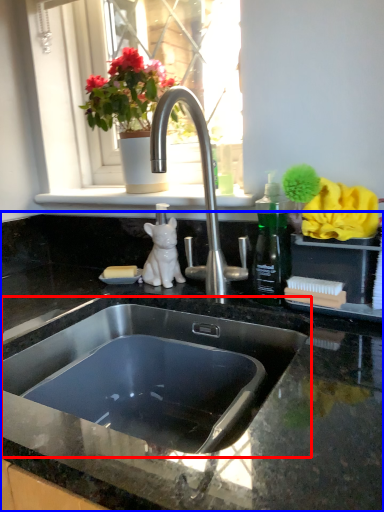
Question: Which object is further to the camera taking this photo, sink (highlighted by a red box) or countertop (highlighted by a blue box)?

Choices:
 (A) sink
 (B) countertop

Answer: (A)